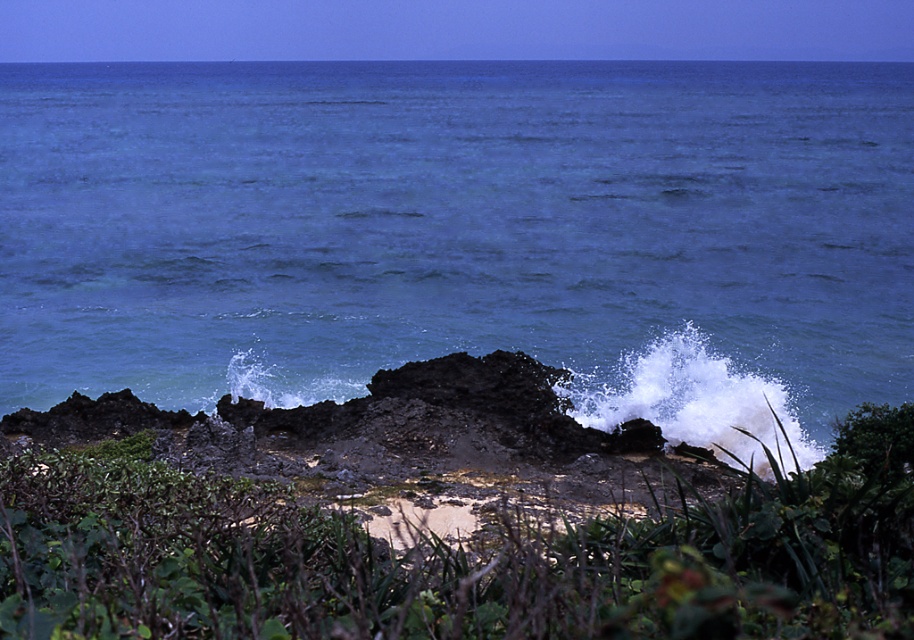
You are standing on the beach and want to take a photo of the blue water at center and the green leafy vegetation at center. Which object should you focus on first if you want both to be in clear focus?

The green leafy vegetation at center is behind blue water at center, so you should focus on the green leafy vegetation at center first to ensure both are in clear focus.

You are standing at the shoreline facing the ocean. You see two points marked on the image. One is at point (134, 284) and the other at point (128, 595). Which point is closer to your current position?

Point (128, 595) is closer to your current position because it is nearer to the camera compared to point (134, 284), which is further away.